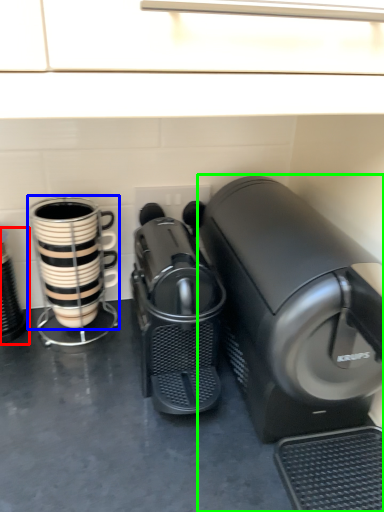
Question: Based on their relative distances, which object is farther from appliance (highlighted by a red box)? Choose from coffee cup (highlighted by a blue box) and home appliance (highlighted by a green box).

Choices:
 (A) coffee cup
 (B) home appliance

Answer: (B)